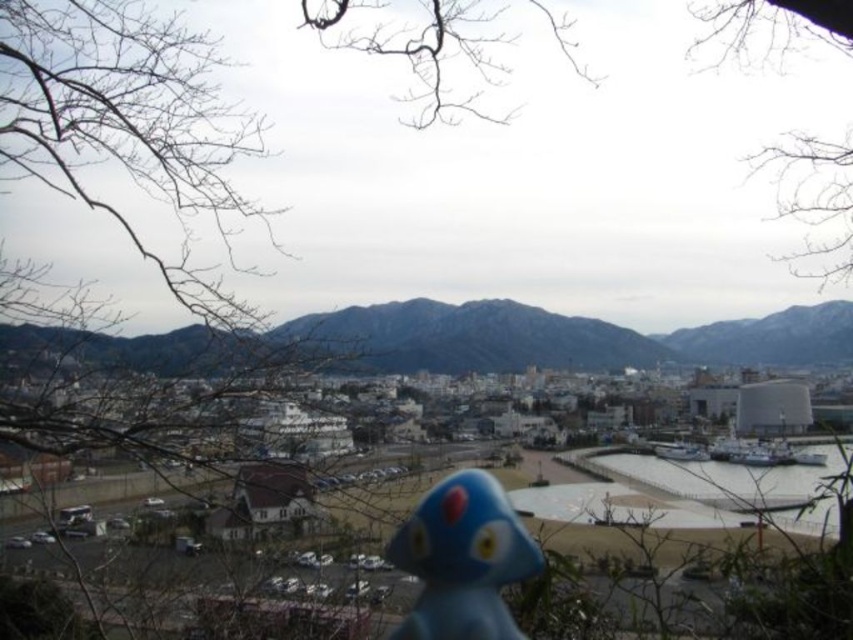
You are a photographer who wants to capture a clear shot of the blue matte figurine at center without the gray rocky mountain at center blocking it. How should you adjust your position or the camera to achieve this?

To capture a clear shot of the blue matte figurine at center without the gray rocky mountain at center blocking it, you should move the camera or your position so that the figurine is no longer behind the mountain. Since the blue matte figurine at center is behind gray rocky mountain at center, adjusting the angle or moving to a position where the mountain is not in between the camera and the figurine would allow for an unobstructed view.

You are a photographer who wants to capture a clear shot of the gray rocky mountain at center and the bare branches at upper center. Based on their positions, which object should you focus on first to ensure both are in focus?

The bare branches at upper center is behind the gray rocky mountain at center, so you should focus on the gray rocky mountain at center first to ensure both are in focus.